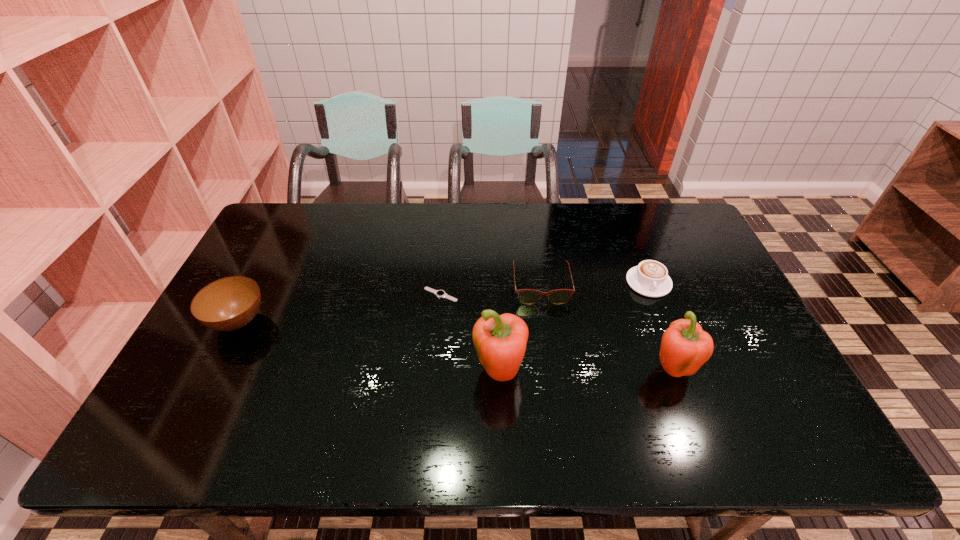
Given the evenly spaced peppers in the image, where should an extra pepper be added on the left to preserve the spacing? Please point to a vacant space. Please provide its 2D coordinates. Your answer should be formatted as a tuple, i.e. [(x, y)], where the tuple contains the x and y coordinates of a point satisfying the conditions above.

[(323, 380)]